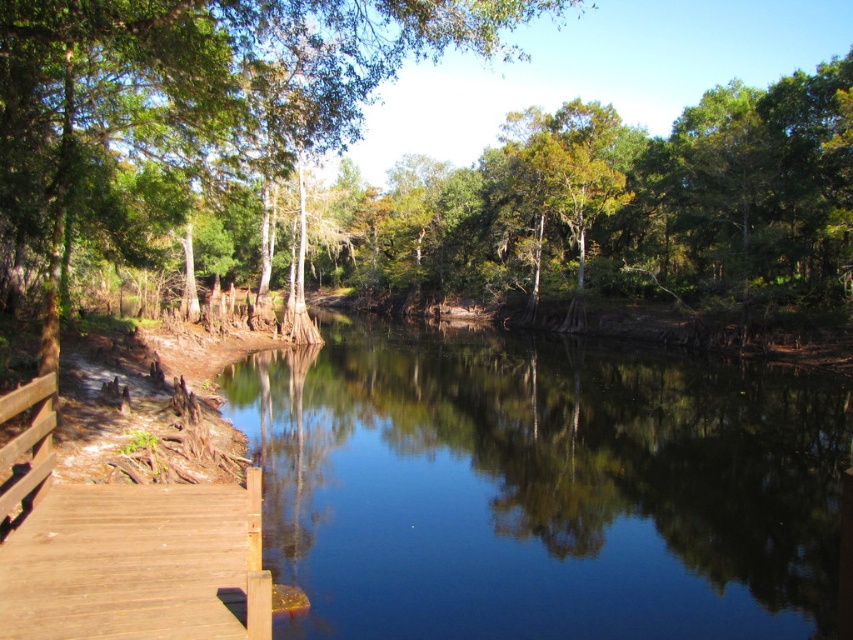
Measure the distance between point (33, 278) and camera.

Answer: Point (33, 278) is 73.42 feet from camera.

Can you confirm if green leafy tree at center is positioned below brown wooden dock at lower left?

Actually, green leafy tree at center is above brown wooden dock at lower left.

Between point (189, 147) and point (177, 618), which one is positioned in front?

Point (177, 618) is in front.

Find the location of `green leafy tree at center`. green leafy tree at center is located at coordinates (187, 115).

Which of these two, clear water at center or green leafy tree at center, stands taller?

Standing taller between the two is green leafy tree at center.

Can you confirm if clear water at center is positioned below green leafy tree at center?

Yes.

Image resolution: width=853 pixels, height=640 pixels. I want to click on clear water at center, so click(x=543, y=486).

Locate an element on the screen. clear water at center is located at coordinates (543, 486).

Is clear water at center smaller than brown wooden dock at lower left?

No.

Between point (675, 522) and point (201, 561), which one is positioned behind?

The point (675, 522) is behind.

Identify the location of clear water at center. The image size is (853, 640). (543, 486).